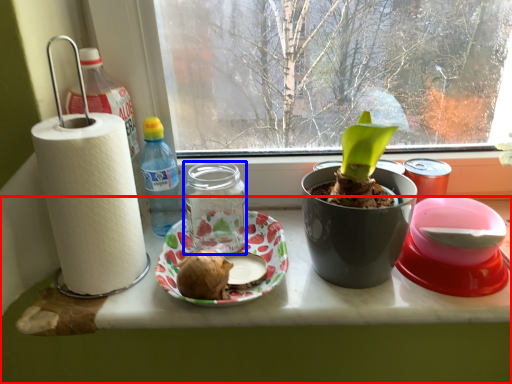
Question: Which point is closer to the camera, table (highlighted by a red box) or glass jar (highlighted by a blue box)?

Choices:
 (A) table
 (B) glass jar

Answer: (A)